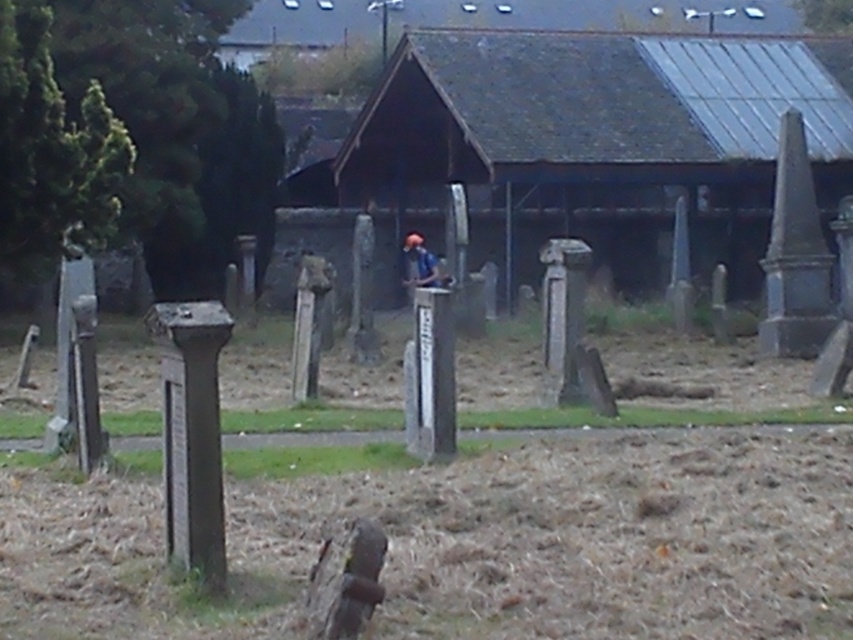
You are standing in the cemetery and see the dark gray wooden hut at center and the matte blue shirt at center. Which object is positioned to the right of the other?

The dark gray wooden hut at center is to the right of the matte blue shirt at center.

You are standing in the cemetery and want to take a photo of the dark gray wooden hut at center and the matte blue shirt at center. Which object should you focus on first to ensure both are in focus?

You should focus on the dark gray wooden hut at center first because it is closer to the viewer than the matte blue shirt at center, so adjusting focus from near to far will help both be in focus.